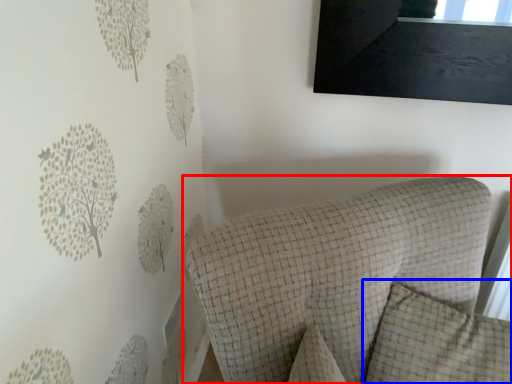
Question: Which point is further to the camera, furniture (highlighted by a red box) or pillow (highlighted by a blue box)?

Choices:
 (A) furniture
 (B) pillow

Answer: (B)